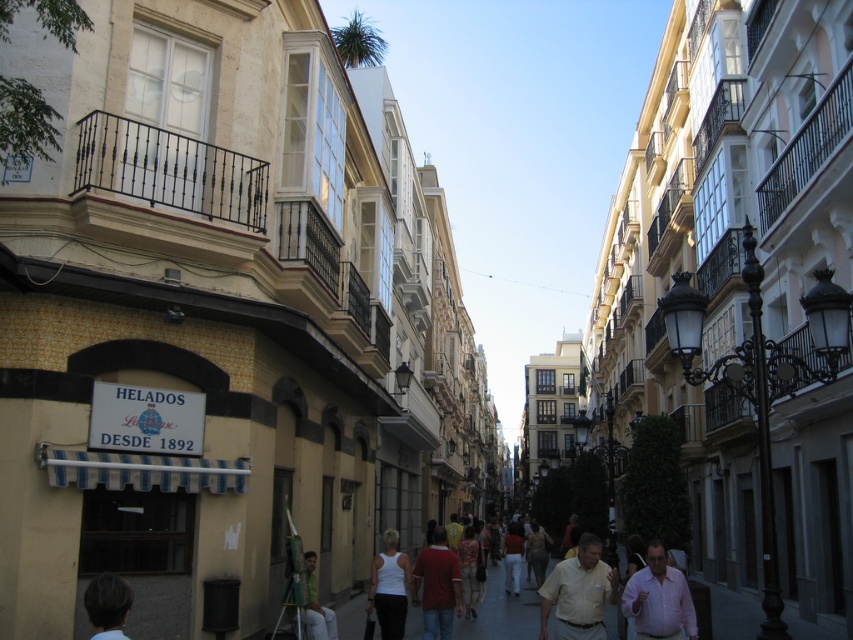
Question: Is light brown shirt at center in front of green fabric shirt at lower center?

Choices:
 (A) no
 (B) yes

Answer: (B)

Question: Can you confirm if light brown hair at lower left is bigger than green fabric shirt at lower center?

Choices:
 (A) yes
 (B) no

Answer: (A)

Question: Does matte red shirt at center have a greater width compared to light brown hair at lower left?

Choices:
 (A) no
 (B) yes

Answer: (B)

Question: Estimate the real-world distances between objects in this image. Which object is closer to the light brown shirt at center?

Choices:
 (A) white matte tank top at center
 (B) green fabric shirt at lower center
 (C) matte red shirt at center

Answer: (C)

Question: Which object is farther from the camera taking this photo?

Choices:
 (A) pink cotton shirt at center
 (B) light brown hair at lower left
 (C) light brown shirt at center

Answer: (C)

Question: Among these objects, which one is farthest from the camera?

Choices:
 (A) matte red shirt at center
 (B) light brown hair at lower left

Answer: (A)